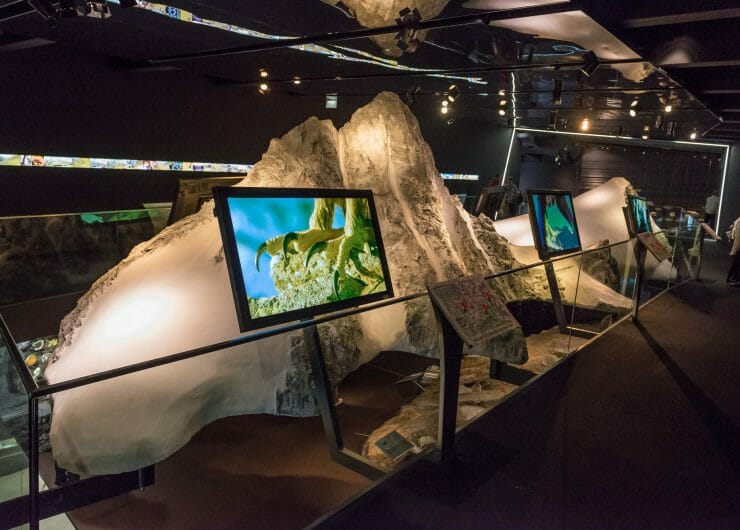
At what (x,y) coordinates should I click in order to perform the action: click on tv screen. Please return your answer as a coordinate pair (x, y). Looking at the image, I should click on (306, 250), (555, 205), (644, 212), (690, 220).